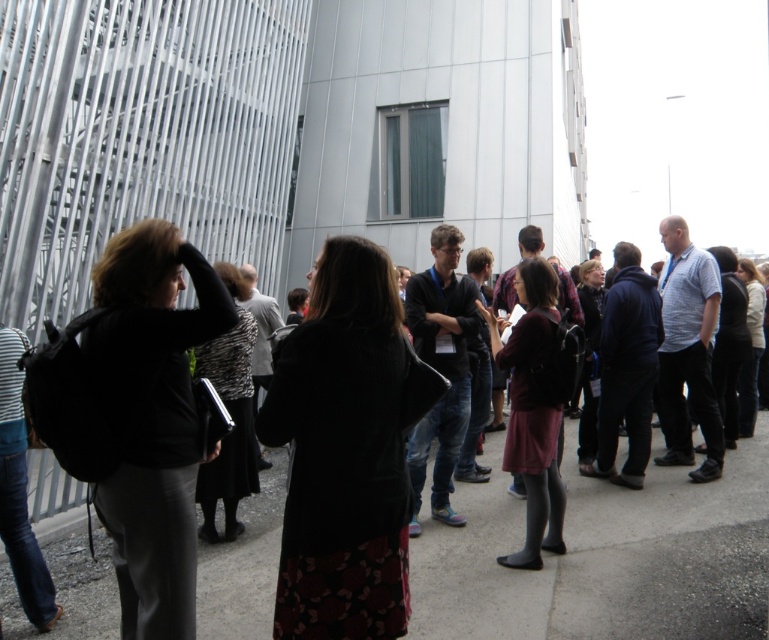
You are standing in the plaza and see two people wearing the dark gray sweater at center and the matte black jacket at left. Which clothing item is positioned more to the left?

The dark gray sweater at center is positioned more to the left than the matte black jacket at left.